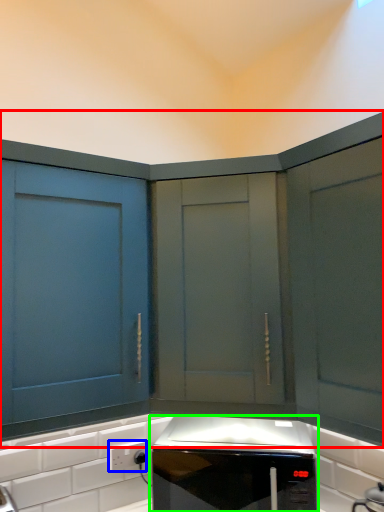
Question: Which object is positioned farthest from cabinetry (highlighted by a red box)? Select from electric outlet (highlighted by a blue box) and home appliance (highlighted by a green box).

Choices:
 (A) electric outlet
 (B) home appliance

Answer: (A)